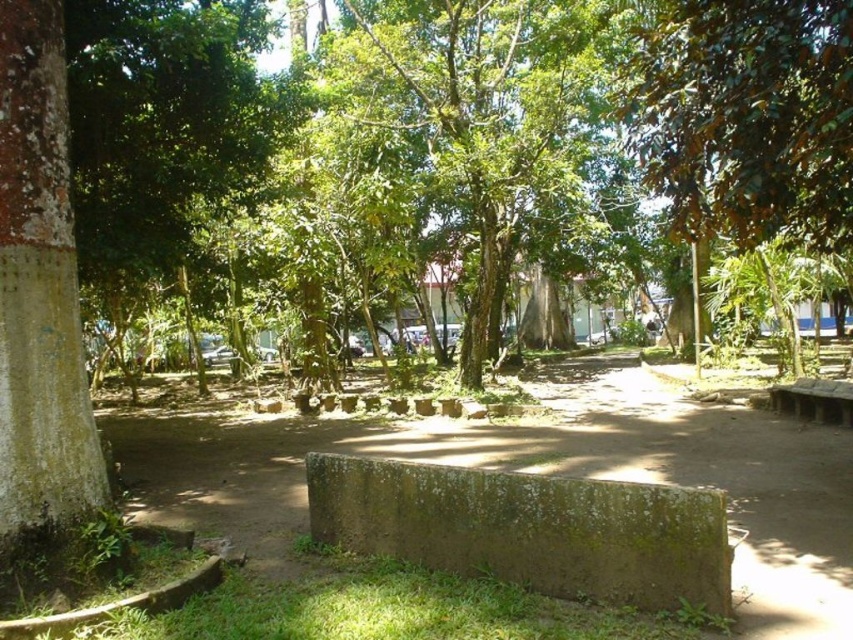
Question: Which point is farther to the camera?

Choices:
 (A) (851, 422)
 (B) (689, 586)

Answer: (A)

Question: Which object is closer to the camera taking this photo?

Choices:
 (A) green leafy tree at center
 (B) smooth brown tree trunk at left
 (C) green mossy concrete at center
 (D) green grass at lower left

Answer: (D)

Question: Which of these objects is positioned closest to the smooth brown tree trunk at left?

Choices:
 (A) green leafy tree at center
 (B) green grass at lower left
 (C) green mossy concrete at center
 (D) brown wooden bench at lower right

Answer: (B)

Question: Is green grass at lower left below brown wooden bench at lower right?

Choices:
 (A) no
 (B) yes

Answer: (B)

Question: Does green leafy tree at center appear on the left side of green grass at lower left?

Choices:
 (A) yes
 (B) no

Answer: (B)

Question: Is green leafy tree at center further to camera compared to smooth brown tree trunk at left?

Choices:
 (A) no
 (B) yes

Answer: (B)